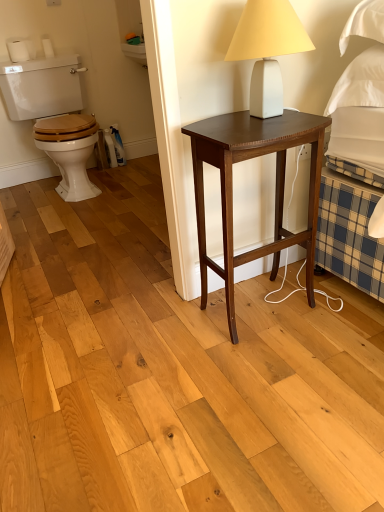
Question: Is wooden at left to the right of dark wood nightstand at center from the viewer's perspective?

Choices:
 (A) no
 (B) yes

Answer: (A)

Question: Is dark wood nightstand at center located within wooden at left?

Choices:
 (A) yes
 (B) no

Answer: (B)

Question: Is wooden at left positioned with its back to dark wood nightstand at center?

Choices:
 (A) yes
 (B) no

Answer: (B)

Question: From the image's perspective, is wooden at left under dark wood nightstand at center?

Choices:
 (A) yes
 (B) no

Answer: (B)

Question: Considering the relative sizes of wooden at left and dark wood nightstand at center in the image provided, is wooden at left smaller than dark wood nightstand at center?

Choices:
 (A) no
 (B) yes

Answer: (A)

Question: Is white matte table lamp at upper right to the left or to the right of wooden at left in the image?

Choices:
 (A) left
 (B) right

Answer: (B)

Question: Looking at the image, does white matte table lamp at upper right seem bigger or smaller compared to wooden at left?

Choices:
 (A) big
 (B) small

Answer: (B)

Question: Considering the positions of white matte table lamp at upper right and wooden at left in the image, is white matte table lamp at upper right taller or shorter than wooden at left?

Choices:
 (A) short
 (B) tall

Answer: (A)

Question: From a real-world perspective, is white matte table lamp at upper right above or below wooden at left?

Choices:
 (A) below
 (B) above

Answer: (B)

Question: From a real-world perspective, is wooden at left above or below white matte table lamp at upper right?

Choices:
 (A) below
 (B) above

Answer: (A)

Question: Considering the positions of point (97, 136) and point (271, 8), is point (97, 136) closer or farther from the camera than point (271, 8)?

Choices:
 (A) closer
 (B) farther

Answer: (B)

Question: From the image's perspective, is wooden at left above or below white matte table lamp at upper right?

Choices:
 (A) above
 (B) below

Answer: (A)

Question: Is wooden at left inside or outside of white matte table lamp at upper right?

Choices:
 (A) inside
 (B) outside

Answer: (B)

Question: Is wooden at left situated inside dark wood nightstand at center or outside?

Choices:
 (A) outside
 (B) inside

Answer: (A)

Question: From the image's perspective, is wooden at left located above or below dark wood nightstand at center?

Choices:
 (A) below
 (B) above

Answer: (B)